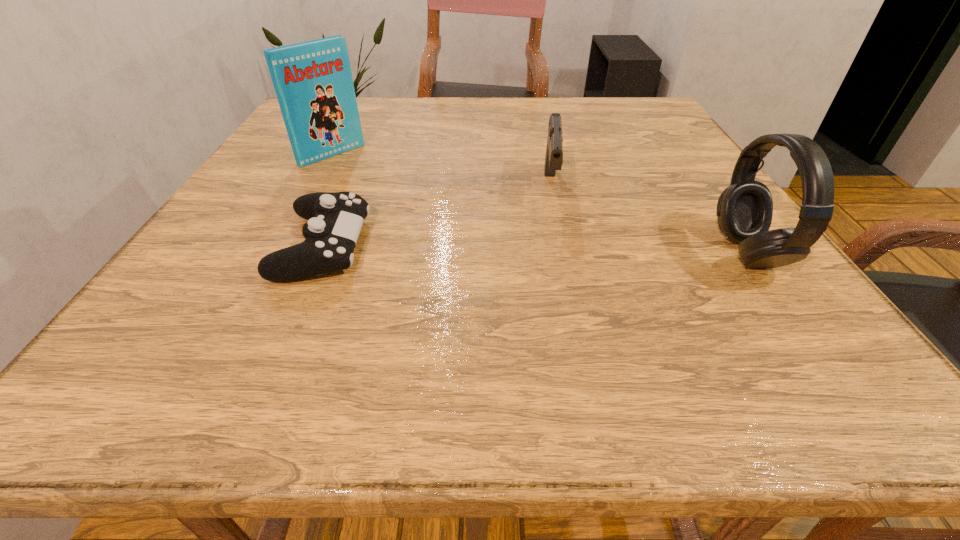
The height and width of the screenshot is (540, 960). I want to click on the shortest object, so click(x=335, y=219).

Locate an element on the screen. This screenshot has height=540, width=960. the rightmost object is located at coordinates (744, 212).

Where is `headset`? headset is located at coordinates (744, 212).

You are a GUI agent. You are given a task and a screenshot of the screen. Output one action in this format:
    pyautogui.click(x=<x>, y=<y>)
    Task: Click on the book
    This screenshot has width=960, height=540.
    Given the screenshot: What is the action you would take?
    pyautogui.click(x=313, y=82)

This screenshot has width=960, height=540. What are the coordinates of `pistol` in the screenshot? It's located at (554, 151).

You are a GUI agent. You are given a task and a screenshot of the screen. Output one action in this format:
    pyautogui.click(x=<x>, y=<y>)
    Task: Click on the second object from right to left
    
    Given the screenshot: What is the action you would take?
    pyautogui.click(x=554, y=151)

The image size is (960, 540). Identify the location of blank space located on the surface of the control. (441, 246).

Find the location of `vacant space located 0.330m on the earcups of the third shortest object`. vacant space located 0.330m on the earcups of the third shortest object is located at coordinates (527, 253).

The height and width of the screenshot is (540, 960). Identify the location of free space located 0.310m on the earcups of the third shortest object. (539, 253).

Locate an element on the screen. vacant space located on the earcups of the third shortest object is located at coordinates (497, 253).